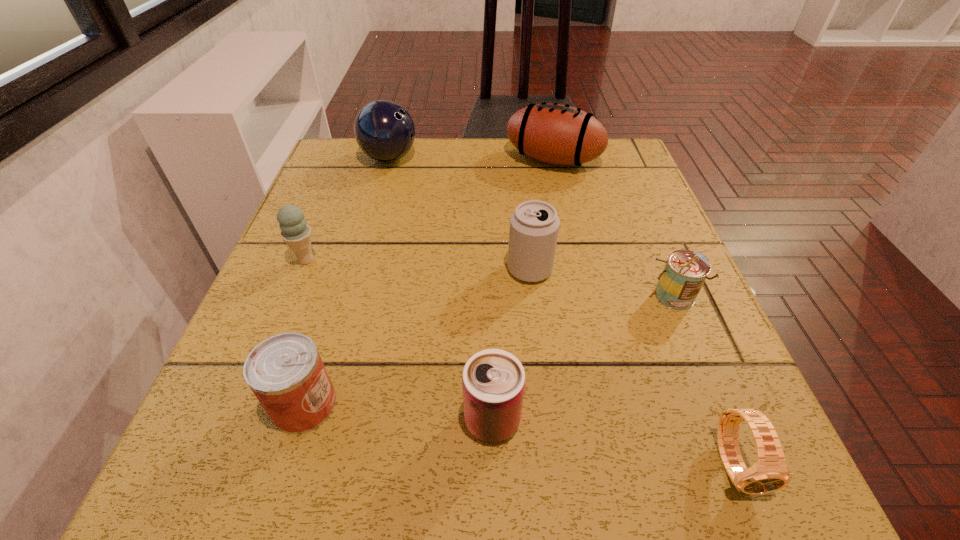
Image resolution: width=960 pixels, height=540 pixels. What are the coordinates of `free location located 0.400m on the back of the leftmost can` in the screenshot? It's located at (363, 214).

Find the location of `bowling ball situated at the far edge`. bowling ball situated at the far edge is located at coordinates (384, 130).

The image size is (960, 540). Identify the location of football (American) present at the far edge. (557, 134).

The height and width of the screenshot is (540, 960). Find the location of `can at the near edge`. can at the near edge is located at coordinates (493, 382).

Find the location of a particular element. This screenshot has height=540, width=960. watch at the near edge is located at coordinates (769, 473).

You are a GUI agent. You are given a task and a screenshot of the screen. Output one action in this format:
    pyautogui.click(x=<x>, y=<y>)
    Task: Click on the bowling ball present at the left edge
    The height and width of the screenshot is (540, 960).
    Given the screenshot: What is the action you would take?
    pyautogui.click(x=384, y=130)

Locate an element on the screen. ice cream located at the left edge is located at coordinates (297, 234).

Identify the location of can at the left edge. (285, 372).

Find the location of `football (American) that is at the right edge`. football (American) that is at the right edge is located at coordinates (557, 134).

At what (x,y) coordinates should I click in order to perform the action: click on can present at the right edge. Please return your answer as a coordinate pair (x, y). Image resolution: width=960 pixels, height=540 pixels. Looking at the image, I should click on (685, 271).